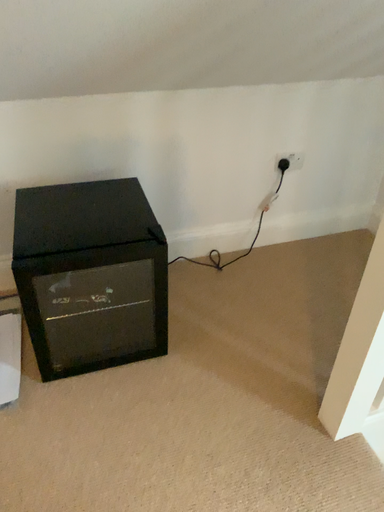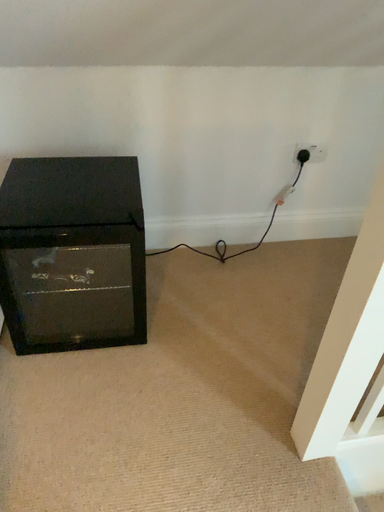
Question: How did the camera likely rotate when shooting the video?

Choices:
 (A) rotated right
 (B) rotated left

Answer: (B)